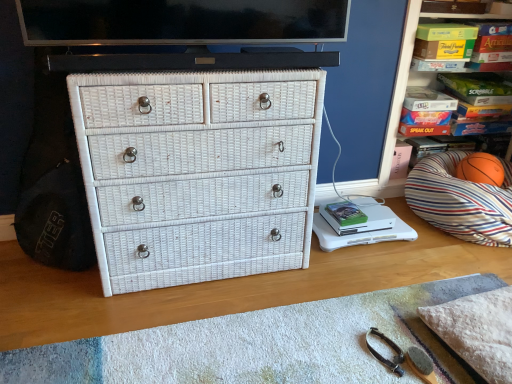
Question: From the image's perspective, relative to white wicker drawer at center, is flat screen tv at upper center above or below?

Choices:
 (A) below
 (B) above

Answer: (B)

Question: From a real-world perspective, is flat screen tv at upper center positioned above or below white wicker drawer at center?

Choices:
 (A) below
 (B) above

Answer: (B)

Question: Which object is positioned closest to the striped fabric pillow at right?

Choices:
 (A) white plastic changing table at lower right
 (B) flat screen tv at upper center
 (C) white textured pillow at lower right
 (D) white wicker drawer at center
 (E) orange rubber basketball at right

Answer: (E)

Question: Estimate the real-world distances between objects in this image. Which object is closer to the orange rubber basketball at right?

Choices:
 (A) white textured pillow at lower right
 (B) white wicker chest of drawers at center
 (C) green matte book at center
 (D) white plastic changing table at lower right
 (E) matte cardboard boxes at upper right

Answer: (E)